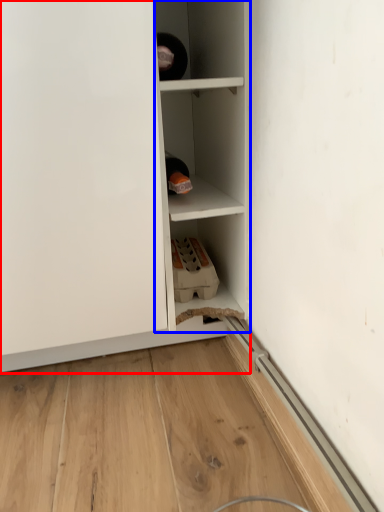
Question: Among these objects, which one is nearest to the camera, cupboard (highlighted by a red box) or cabinetry (highlighted by a blue box)?

Choices:
 (A) cupboard
 (B) cabinetry

Answer: (A)